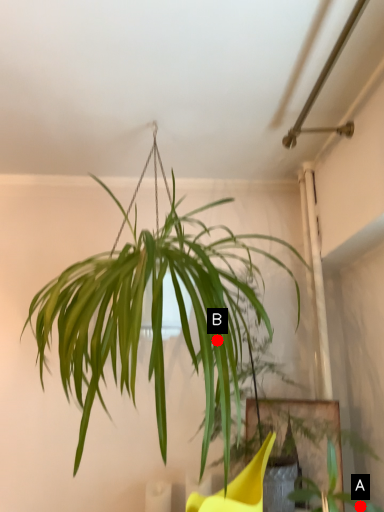
Question: Two points are circled on the image, labeled by A and B beside each circle. Which point is closer to the camera?

Choices:
 (A) A is closer
 (B) B is closer

Answer: (B)